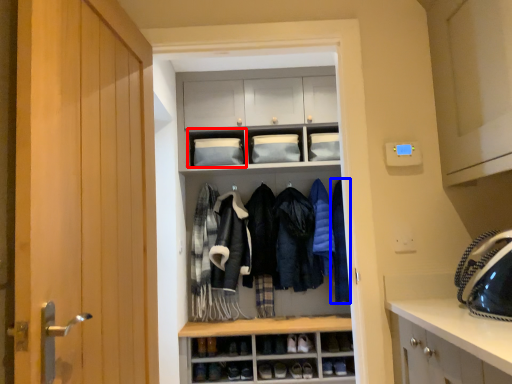
Question: Which of the following is the farthest to the observer, cabinet (highlighted by a red box) or clothing (highlighted by a blue box)?

Choices:
 (A) cabinet
 (B) clothing

Answer: (A)